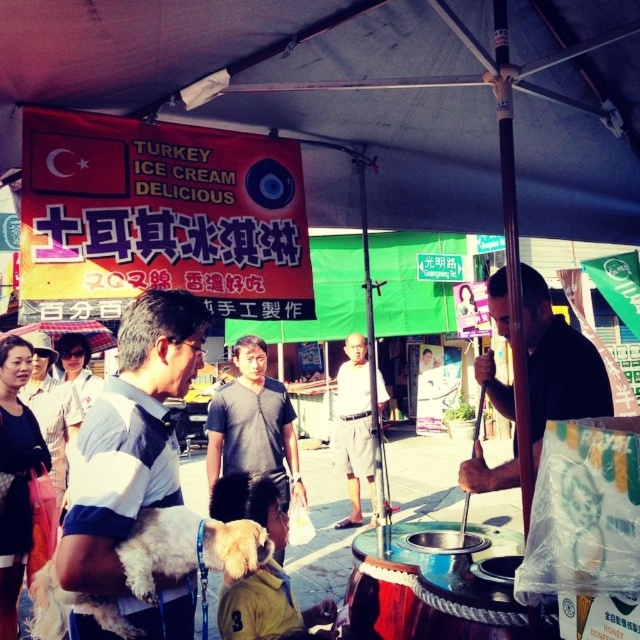
Question: Which of the following is the farthest from the observer?

Choices:
 (A) light gray cotton shorts at center
 (B) transparent plastic umbrella at upper left

Answer: (A)

Question: Which object is positioned closest to the transparent plastic umbrella at upper left?

Choices:
 (A) white soft dog at left
 (B) light gray cotton shorts at center

Answer: (A)

Question: Observing the image, what is the correct spatial positioning of black fabric street vendor at center in reference to light gray cotton shorts at center?

Choices:
 (A) below
 (B) above

Answer: (B)

Question: Is light gray cotton shorts at center to the left of transparent plastic umbrella at upper left from the viewer's perspective?

Choices:
 (A) no
 (B) yes

Answer: (A)

Question: Which of the following is the farthest from the observer?

Choices:
 (A) black fabric street vendor at center
 (B) transparent plastic umbrella at upper left
 (C) light gray cotton shorts at center

Answer: (C)

Question: Does black fabric street vendor at center appear on the right side of transparent plastic umbrella at upper left?

Choices:
 (A) yes
 (B) no

Answer: (A)